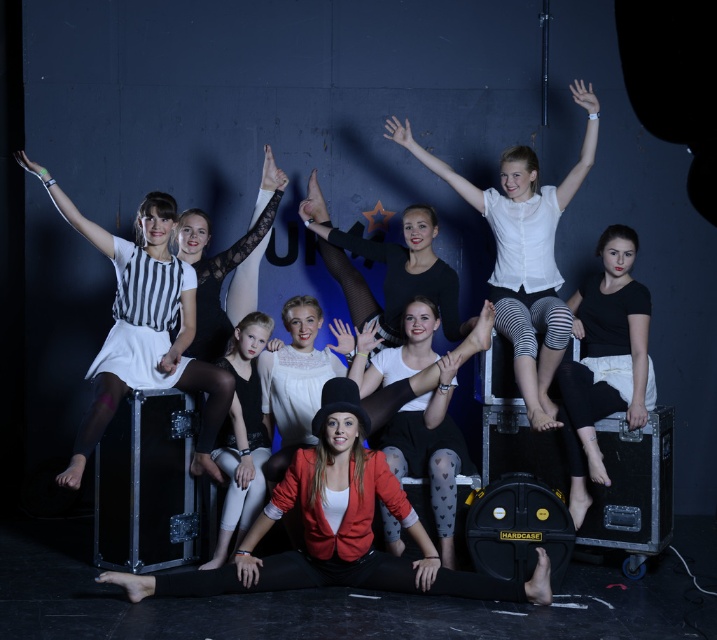
What is the color of the clothing item at the point with coordinates (518, 189)?

The point at coordinates (518, 189) is on the white sheer blouse at center.

You are a photographer standing at the front of the stage. You want to take a picture of the red matte blazer at center. Where should you aim your camera to capture it?

The red matte blazer at center is located at point 0.827 on the x axis and 0.471 on the y axis, so aim your camera at those coordinates to capture it.